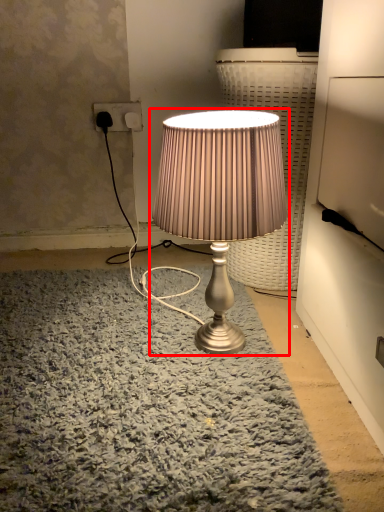
Question: In this image, where is lamp (annotated by the red box) located relative to electric outlet?

Choices:
 (A) left
 (B) right

Answer: (B)